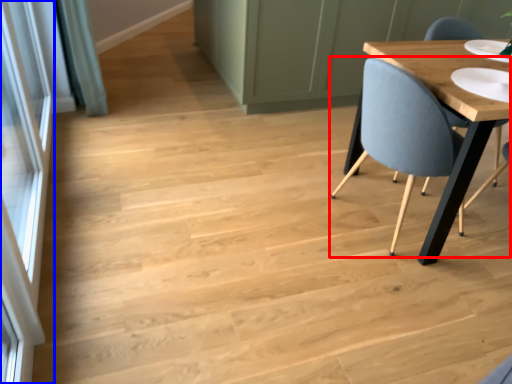
Question: Which of the following is the farthest to the observer, chair (highlighted by a red box) or screen door (highlighted by a blue box)?

Choices:
 (A) chair
 (B) screen door

Answer: (A)